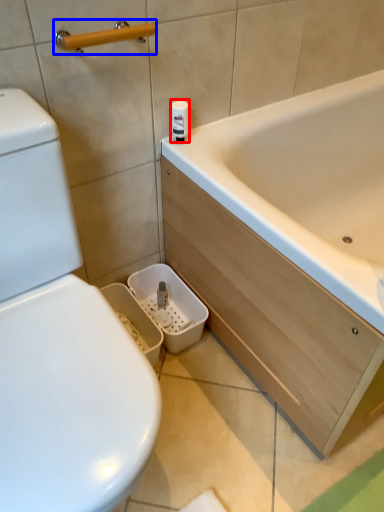
Question: Which point is closer to the camera, toilet paper (highlighted by a red box) or towel bar (highlighted by a blue box)?

Choices:
 (A) toilet paper
 (B) towel bar

Answer: (B)